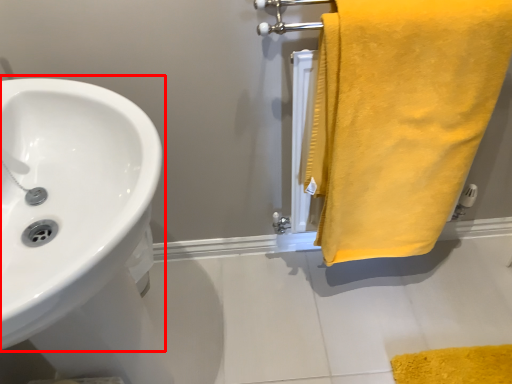
Question: Where is sink (annotated by the red box) located in relation to towel in the image?

Choices:
 (A) right
 (B) left

Answer: (B)